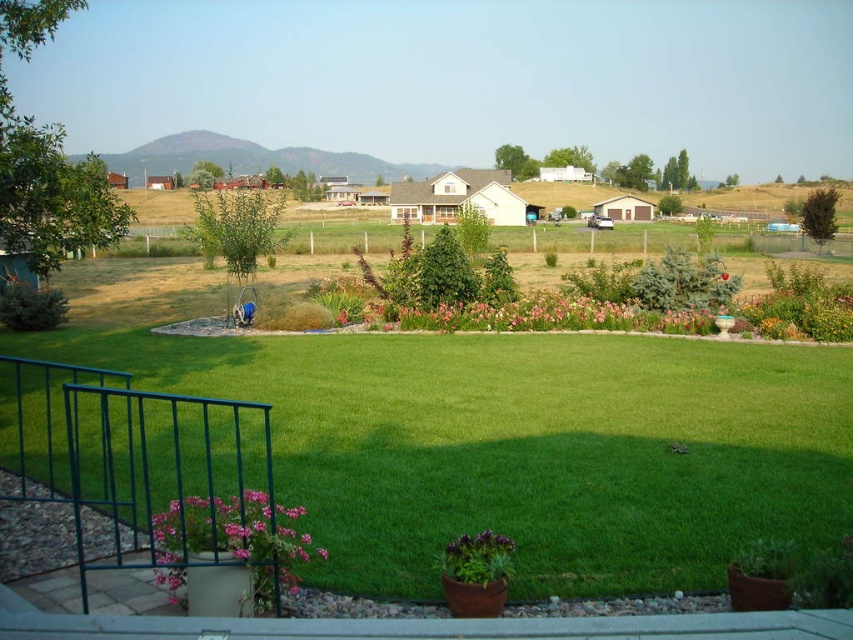
Question: Which object is the farthest from the pink matte flowers at center?

Choices:
 (A) green grass at center
 (B) pink matte flower at lower center
 (C) green metal railing at lower left
 (D) purple matte flower at center

Answer: (B)

Question: Estimate the real-world distances between objects in this image. Which object is closer to the pink matte flowers at center?

Choices:
 (A) purple matte flower at center
 (B) green grass at center
 (C) green metal railing at lower left

Answer: (B)

Question: Is the position of green metal railing at lower left less distant than that of pink matte flowers at center?

Choices:
 (A) yes
 (B) no

Answer: (A)

Question: Is green grass at center positioned at the back of purple matte flower at center?

Choices:
 (A) no
 (B) yes

Answer: (B)

Question: Is green metal railing at lower left bigger than pink matte flowers at center?

Choices:
 (A) no
 (B) yes

Answer: (B)

Question: Estimate the real-world distances between objects in this image. Which object is closer to the pink matte flower at lower center?

Choices:
 (A) green grass at center
 (B) purple matte flower at center
 (C) green metal railing at lower left

Answer: (C)